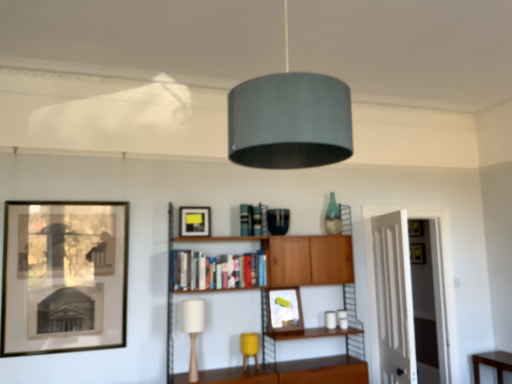
The image size is (512, 384). Find the location of `empty space that is ontop of white matte table lamp at center, which is the second table lamp from right to left`. empty space that is ontop of white matte table lamp at center, which is the second table lamp from right to left is located at coordinates (195, 295).